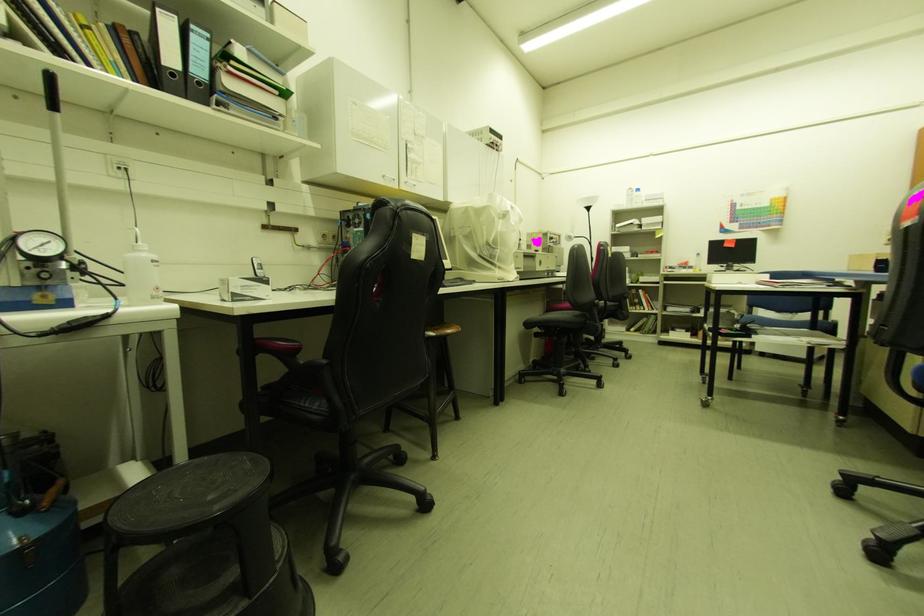
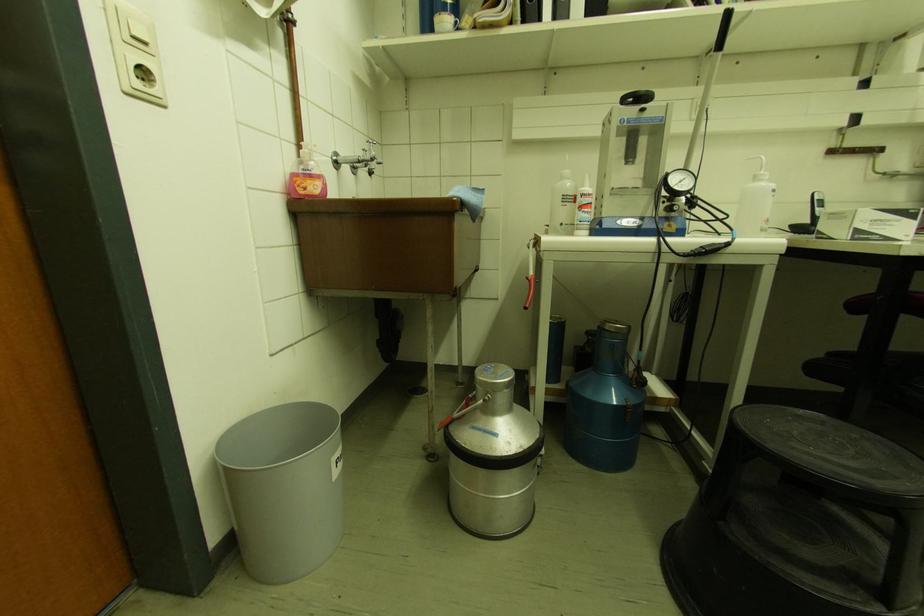
Where in the second image is the point corresponding to point 213,499 from the first image?

(857, 466)